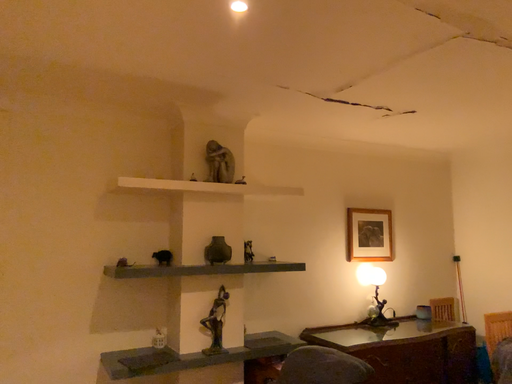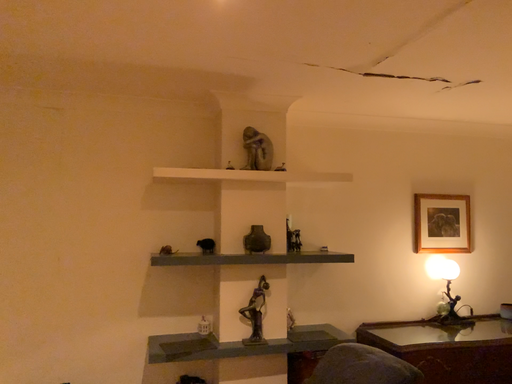
Question: Which way did the camera rotate in the video?

Choices:
 (A) rotated left
 (B) rotated right

Answer: (A)